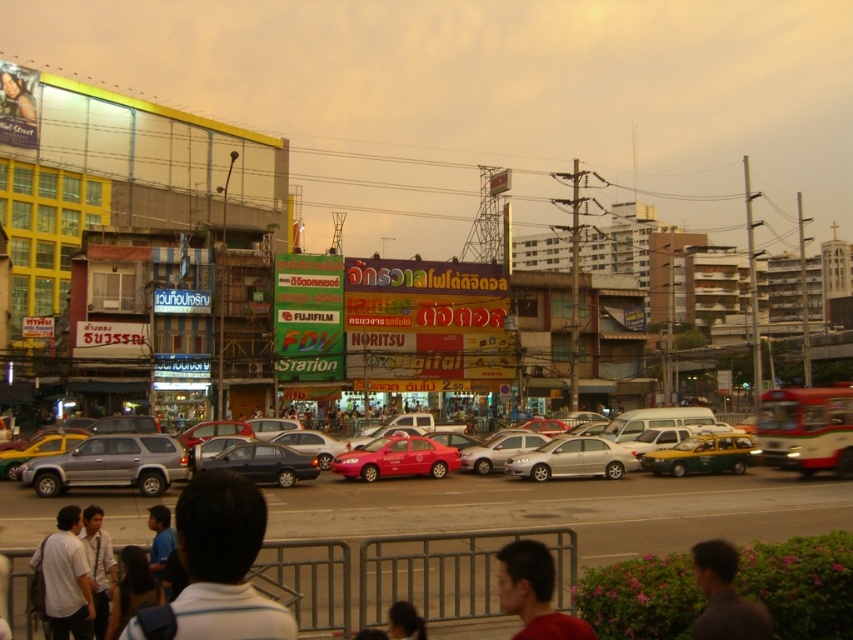
Which is above, satin silver sedan at center or dark hair at center?

dark hair at center

Is point (601, 458) closer to viewer compared to point (416, 627)?

No, (601, 458) is further to viewer.

The width and height of the screenshot is (853, 640). Identify the location of satin silver sedan at center. (572, 460).

The image size is (853, 640). I want to click on matte red shirt at lower center, so click(x=534, y=593).

Between matte red shirt at lower center and shiny dark gray sedan at center, which one is positioned lower?

shiny dark gray sedan at center is lower down.

Image resolution: width=853 pixels, height=640 pixels. Identify the location of matte red shirt at lower center. (534, 593).

Find the location of `matte red shirt at lower center`. matte red shirt at lower center is located at coordinates (534, 593).

Between silver metallic suv at center and matte red shirt at lower center, which one has more height?

With more height is silver metallic suv at center.

Is point (47, 472) more distant than point (581, 628)?

Yes, it is.

What do you see at coordinates (111, 465) in the screenshot? I see `silver metallic suv at center` at bounding box center [111, 465].

You are a GUI agent. You are given a task and a screenshot of the screen. Output one action in this format:
    pyautogui.click(x=<x>, y=<y>)
    Task: Click on the silver metallic suv at center
    This screenshot has height=640, width=853.
    Given the screenshot: What is the action you would take?
    pyautogui.click(x=111, y=465)